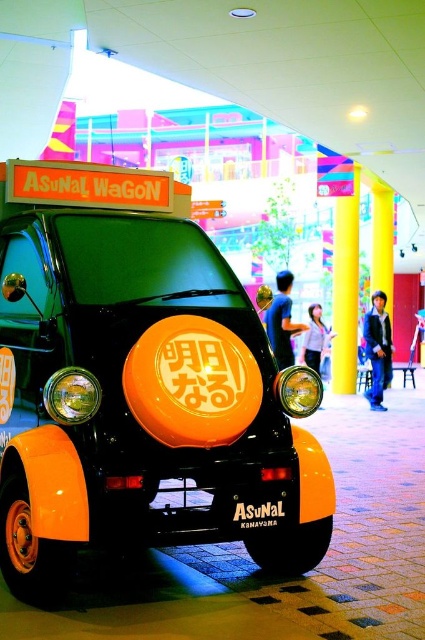
You are a photographer setting up a shoot in the mall. You have a camera with a 100mm lens that can focus on objects up to 2 meters away. You want to capture both the orange matte vehicle at center and the orange matte sign at center in the same frame. Since the vehicle is larger, where should you position yourself relative to them to ensure both fit in the frame?

Since the orange matte vehicle at center is bigger than the orange matte sign at center, you should move further away from them to ensure both fit in the frame. This way, the larger vehicle will appear smaller in the frame, balancing its size with the smaller sign.

You are a photographer positioned at the entrance of the mall. You want to capture a photo of the orange matte vehicle at center and the orange matte sign at center such that both are clearly visible in the frame. Based on their positions, can you ensure that both objects are fully visible in the photo?

The orange matte vehicle at center is in front of the orange matte sign at center. Since the vehicle is blocking part of the sign, it may be challenging to capture both fully visible in the frame. Adjust the angle or position to ensure both are visible.

You are standing at the entrance of the mall and see the point marked at coordinates (141, 388). Which object is this point located on?

The point marked at coordinates (141, 388) is located on the orange matte vehicle at center.